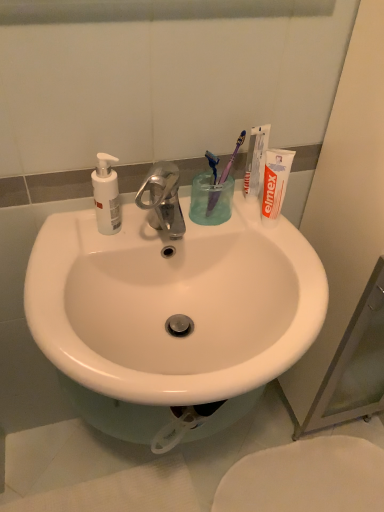
Find the location of a particular element. The width and height of the screenshot is (384, 512). vacant space that is to the left of white matte soap dispenser at left is located at coordinates (64, 231).